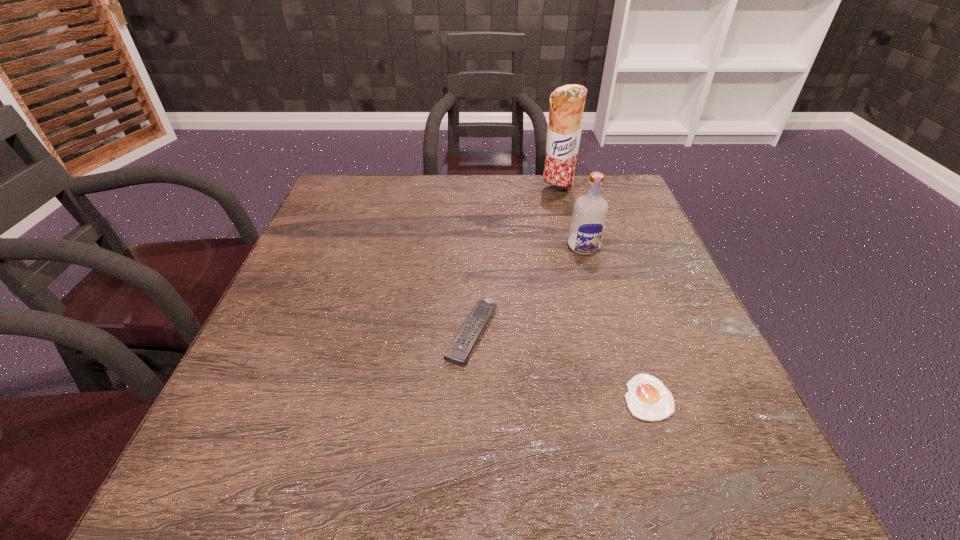
I want to click on free space that is in between the remote control and the vodka, so click(x=528, y=290).

This screenshot has width=960, height=540. In order to click on empty location between the leftmost object and the egg yolk in this screenshot , I will do `click(560, 365)`.

Where is `object that stands as the third closest to the farthest object`? This screenshot has height=540, width=960. object that stands as the third closest to the farthest object is located at coordinates (648, 399).

Identify which object is the closest to the farthest object. Please provide its 2D coordinates. Your answer should be formatted as a tuple, i.e. [(x, y)], where the tuple contains the x and y coordinates of a point satisfying the conditions above.

[(589, 215)]

You are a GUI agent. You are given a task and a screenshot of the screen. Output one action in this format:
    pyautogui.click(x=<x>, y=<y>)
    Task: Click on the free spot that satisfies the following two spatial constraints: 1. on the back side of the burrito; 2. on the left side of the leftmost object
    This screenshot has width=960, height=540.
    Given the screenshot: What is the action you would take?
    pyautogui.click(x=474, y=191)

Find the location of `vacant position in the image that satisfies the following two spatial constraints: 1. on the label of the egg yolk; 2. on the right side of the vodka`. vacant position in the image that satisfies the following two spatial constraints: 1. on the label of the egg yolk; 2. on the right side of the vodka is located at coordinates (628, 397).

Identify the location of vacant space that satisfies the following two spatial constraints: 1. on the label of the egg yolk; 2. on the right side of the third nearest object. This screenshot has width=960, height=540. (628, 397).

The image size is (960, 540). Identify the location of free region that satisfies the following two spatial constraints: 1. on the front side of the shortest object; 2. on the left side of the third farthest object. (470, 397).